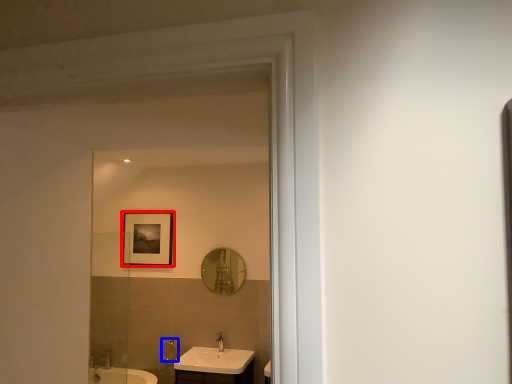
Question: Which object is further to the camera taking this photo, picture frame (highlighted by a red box) or shower (highlighted by a blue box)?

Choices:
 (A) picture frame
 (B) shower

Answer: (A)